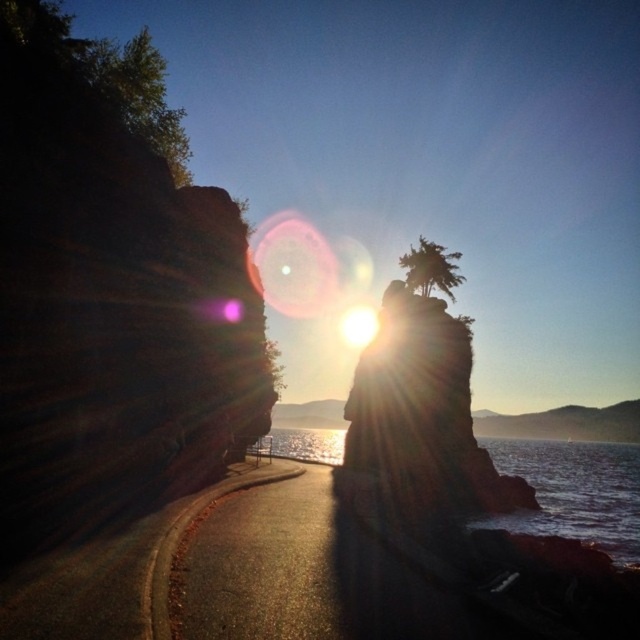
You are a photographer wanting to capture the contrast between the rustic stone rock formation at center and the bright white light at center. Which object appears larger in the scene?

The bright white light at center appears larger than the rustic stone rock formation at center.

You are a photographer standing at the edge of the paved road in the coastal scene. You want to capture a photo where both the translucent glass water at center and the bright white light at center are visible. Which object will appear taller in the photo?

The translucent glass water at center will appear taller in the photo since it has a greater height compared to the bright white light at center according to the description.

You are standing at the point with coordinates point (422, 413) in the coastal scene. What is the object located at that position?

The point (422, 413) corresponds to the rustic stone rock formation at center.